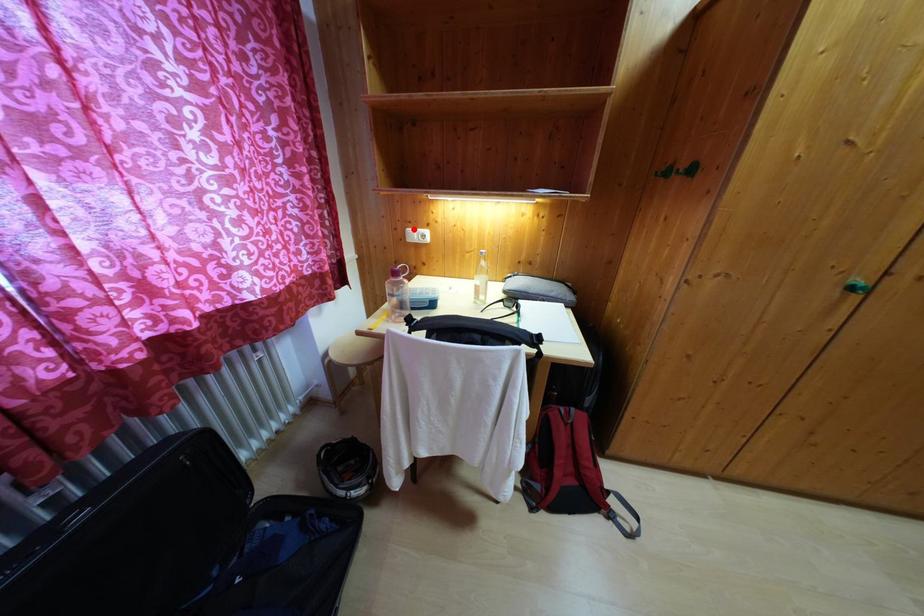
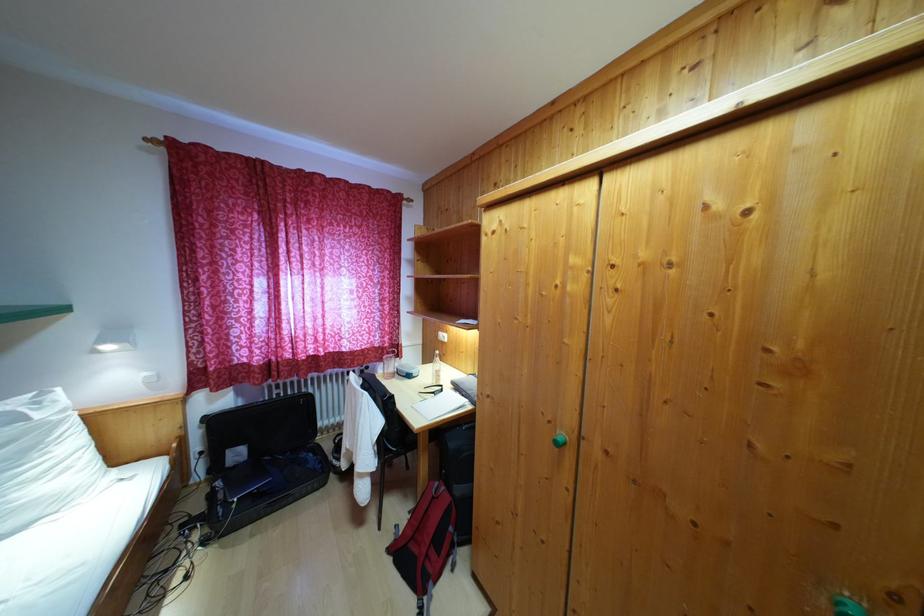
Question: I am providing you with two images of the same scene from different viewpoints. A red point is marked on the first image. At the location where the point appears in image 1, is it still visible in image 2?

Choices:
 (A) Yes
 (B) No

Answer: (B)